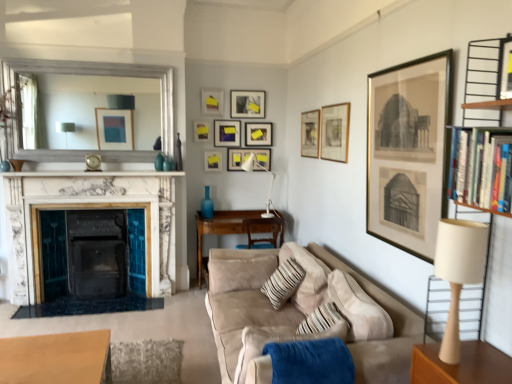
At what (x,y) coordinates should I click in order to perform the action: click on vacant space underneath wooden frame mirror at upper left (from a real-world perspective). Please return your answer as a coordinate pair (x, y). This screenshot has height=384, width=512. Looking at the image, I should click on (93, 167).